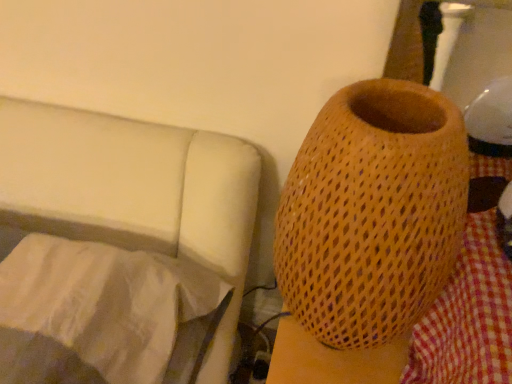
Describe the element at coordinates (102, 314) in the screenshot. I see `white fabric at lower left` at that location.

Where is `white fabric at lower left`? The image size is (512, 384). white fabric at lower left is located at coordinates (102, 314).

The height and width of the screenshot is (384, 512). Describe the element at coordinates (372, 212) in the screenshot. I see `brown woven vase at right` at that location.

In order to click on brown woven vase at right in this screenshot , I will do `click(372, 212)`.

Image resolution: width=512 pixels, height=384 pixels. I want to click on white fabric at lower left, so click(x=102, y=314).

Considering the relative positions of brown woven vase at right and white fabric at lower left in the image provided, is brown woven vase at right to the right of white fabric at lower left from the viewer's perspective?

Indeed, brown woven vase at right is positioned on the right side of white fabric at lower left.

Which object is closer to the camera, brown woven vase at right or white fabric at lower left?

brown woven vase at right is in front.

Considering the positions of points (452, 120) and (39, 333), is point (452, 120) farther from camera compared to point (39, 333)?

That is False.

From the image's perspective, relative to white fabric at lower left, is brown woven vase at right above or below?

brown woven vase at right is above white fabric at lower left.

Consider the image. From a real-world perspective, who is located higher, brown woven vase at right or white fabric at lower left?

brown woven vase at right is physically above.

Considering the relative sizes of brown woven vase at right and white fabric at lower left in the image provided, is brown woven vase at right thinner than white fabric at lower left?

Yes.

Is brown woven vase at right taller than white fabric at lower left?

Yes, brown woven vase at right is taller than white fabric at lower left.

Is brown woven vase at right bigger than white fabric at lower left?

No.

Could white fabric at lower left be considered to be inside brown woven vase at right?

No, white fabric at lower left is located outside of brown woven vase at right.

Does brown woven vase at right touch white fabric at lower left?

There is a gap between brown woven vase at right and white fabric at lower left.

Is brown woven vase at right turned away from white fabric at lower left?

That's not correct — brown woven vase at right is not looking away from white fabric at lower left.

Find the location of a particular element. sheet on the left of brown woven vase at right is located at coordinates (102, 314).

Between white fabric at lower left and brown woven vase at right, which one appears on the left side from the viewer's perspective?

Positioned to the left is white fabric at lower left.

Is white fabric at lower left further to the viewer compared to brown woven vase at right?

Yes, white fabric at lower left is further from the viewer.

Which is nearer, (203, 341) or (298, 209)?

Point (298, 209)

From the image's perspective, is white fabric at lower left above or below brown woven vase at right?

white fabric at lower left is situated lower than brown woven vase at right in the image.

Consider the image. From a real-world perspective, is white fabric at lower left positioned above or below brown woven vase at right?

In terms of real-world spatial position, white fabric at lower left is below brown woven vase at right.

Considering the sizes of objects white fabric at lower left and brown woven vase at right in the image provided, who is wider, white fabric at lower left or brown woven vase at right?

white fabric at lower left is wider.

Who is taller, white fabric at lower left or brown woven vase at right?

With more height is brown woven vase at right.

Considering the sizes of white fabric at lower left and brown woven vase at right in the image, is white fabric at lower left bigger or smaller than brown woven vase at right?

Clearly, white fabric at lower left is larger in size than brown woven vase at right.

Would you say white fabric at lower left is inside or outside brown woven vase at right?

The correct answer is: outside.

Are white fabric at lower left and brown woven vase at right located far from each other?

No, there isn't a large distance between white fabric at lower left and brown woven vase at right.

Is white fabric at lower left oriented towards brown woven vase at right?

No, white fabric at lower left is not aimed at brown woven vase at right.

Can you tell me how much white fabric at lower left and brown woven vase at right differ in facing direction?

There is a 2.27-degree angle between the facing directions of white fabric at lower left and brown woven vase at right.

This screenshot has height=384, width=512. I want to click on sheet below the brown woven vase at right (from a real-world perspective), so click(x=102, y=314).

I want to click on vase in front of the white fabric at lower left, so click(372, 212).

Locate an element on the screen. vase on the right of white fabric at lower left is located at coordinates (372, 212).